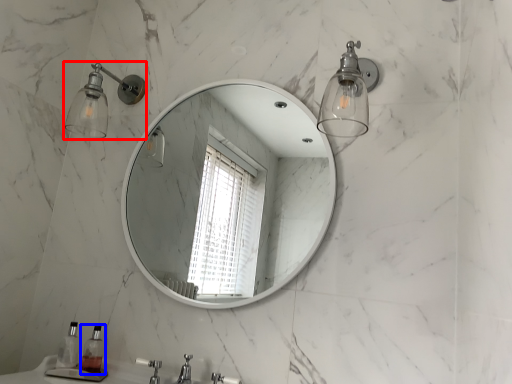
Question: Among these objects, which one is farthest to the camera, shower (highlighted by a red box) or soap dispenser (highlighted by a blue box)?

Choices:
 (A) shower
 (B) soap dispenser

Answer: (A)